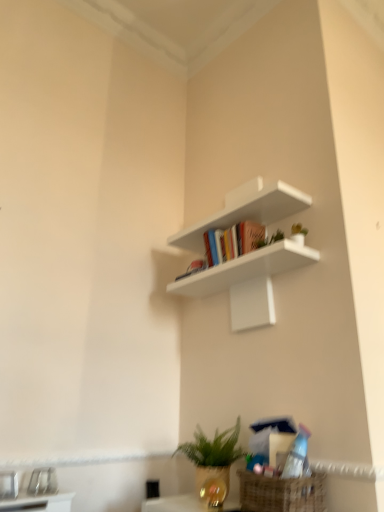
Locate an element on the screen. green matte plant at lower center is located at coordinates (213, 462).

The height and width of the screenshot is (512, 384). I want to click on white matte shelf at upper center, so click(244, 270).

Between matte plastic book at center and green matte plant at lower center, which one has smaller size?

Smaller between the two is matte plastic book at center.

Which is less distant, (x=300, y=430) or (x=214, y=450)?

Point (x=300, y=430) appears to be closer to the viewer than point (x=214, y=450).

From a real-world perspective, which is physically above, matte plastic book at center or green matte plant at lower center?

matte plastic book at center is physically above.

Is matte plastic book at center facing away from green matte plant at lower center?

No, matte plastic book at center's orientation is not away from green matte plant at lower center.

Between green matte plant at lower center and white matte shelf at upper center, which one has smaller size?

green matte plant at lower center is smaller.

Is there a large distance between green matte plant at lower center and white matte shelf at upper center?

No, green matte plant at lower center is not far away from white matte shelf at upper center.

Can you tell me how much green matte plant at lower center and white matte shelf at upper center differ in facing direction?

green matte plant at lower center and white matte shelf at upper center are facing 1.94 degrees away from each other.

Does green matte plant at lower center appear on the right side of white matte shelf at upper center?

Incorrect, green matte plant at lower center is not on the right side of white matte shelf at upper center.

Looking at this image, who is shorter, white matte shelf at upper center or matte plastic book at center?

matte plastic book at center is shorter.

From the image's perspective, which object appears higher, white matte shelf at upper center or matte plastic book at center?

white matte shelf at upper center, from the image's perspective.

You are a GUI agent. You are given a task and a screenshot of the screen. Output one action in this format:
    pyautogui.click(x=<x>, y=<y>)
    Task: Click on the book on the right of white matte shelf at upper center
    Image resolution: width=384 pixels, height=512 pixels.
    Given the screenshot: What is the action you would take?
    pyautogui.click(x=275, y=425)

Is white matte shelf at upper center next to matte plastic book at center and touching it?

white matte shelf at upper center and matte plastic book at center are clearly separated.

Is the position of white matte shelf at upper center more distant than that of green matte plant at lower center?

No, white matte shelf at upper center is in front of green matte plant at lower center.

Could you tell me if white matte shelf at upper center is turned towards green matte plant at lower center?

No.

Which of these two, white matte shelf at upper center or green matte plant at lower center, is thinner?

With smaller width is white matte shelf at upper center.

Do you think white matte shelf at upper center is within green matte plant at lower center, or outside of it?

white matte shelf at upper center is spatially situated outside green matte plant at lower center.

Between matte plastic book at center and white matte shelf at upper center, which one has less height?

Standing shorter between the two is matte plastic book at center.

Which object is closer to the camera taking this photo, matte plastic book at center or white matte shelf at upper center?

matte plastic book at center is closer to the camera.

Considering the positions of point (259, 423) and point (202, 238), is point (259, 423) closer or farther from the camera than point (202, 238)?

Clearly, point (259, 423) is closer to the camera than point (202, 238).

Is matte plastic book at center positioned beyond the bounds of white matte shelf at upper center?

Yes.

Considering the sizes of green matte plant at lower center and matte plastic book at center in the image, is green matte plant at lower center wider or thinner than matte plastic book at center?

Considering their sizes, green matte plant at lower center looks broader than matte plastic book at center.

Do you think green matte plant at lower center is within matte plastic book at center, or outside of it?

green matte plant at lower center is spatially situated outside matte plastic book at center.

From the image's perspective, is green matte plant at lower center under matte plastic book at center?

Yes, from the image's perspective, green matte plant at lower center is beneath matte plastic book at center.

Are green matte plant at lower center and matte plastic book at center far apart?

No, green matte plant at lower center is in close proximity to matte plastic book at center.

Locate an element on the screen. houseplant located behind the matte plastic book at center is located at coordinates (213, 462).

Where is `shelf located on the right of green matte plant at lower center`? This screenshot has height=512, width=384. shelf located on the right of green matte plant at lower center is located at coordinates (244, 270).

Estimate the real-world distances between objects in this image. Which object is closer to matte plastic book at center, white matte shelf at upper center or green matte plant at lower center?

green matte plant at lower center is positioned closer to the anchor matte plastic book at center.

When comparing their distances from green matte plant at lower center, does matte plastic book at center or white matte shelf at upper center seem closer?

matte plastic book at center.

Based on their spatial positions, is green matte plant at lower center or matte plastic book at center further from white matte shelf at upper center?

green matte plant at lower center lies further to white matte shelf at upper center than the other object.

From the image, which object appears to be farther from green matte plant at lower center, white matte shelf at upper center or matte plastic book at center?

The object further to green matte plant at lower center is white matte shelf at upper center.

Based on their spatial positions, is matte plastic book at center or green matte plant at lower center closer to white matte shelf at upper center?

matte plastic book at center is closer to white matte shelf at upper center.

Estimate the real-world distances between objects in this image. Which object is further from matte plastic book at center, green matte plant at lower center or white matte shelf at upper center?

white matte shelf at upper center is positioned further to the anchor matte plastic book at center.

At what (x,y) coordinates should I click in order to perform the action: click on book between white matte shelf at upper center and green matte plant at lower center from top to bottom. Please return your answer as a coordinate pair (x, y). The height and width of the screenshot is (512, 384). Looking at the image, I should click on (275, 425).